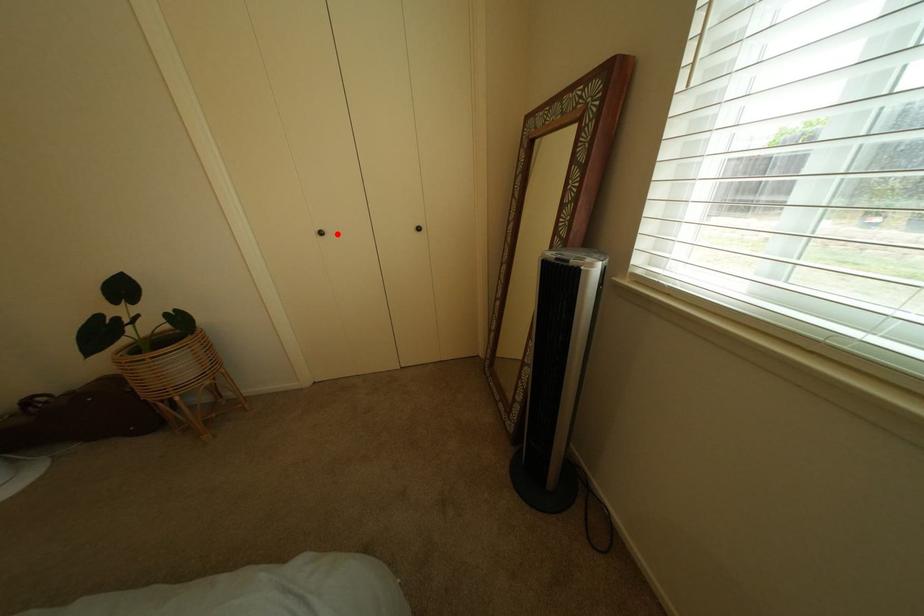
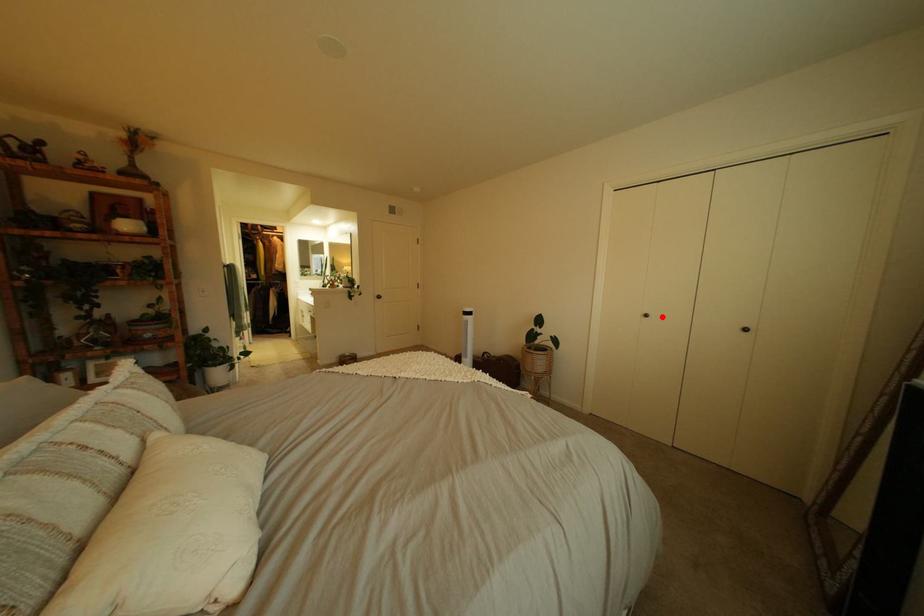
I am providing you with two images of the same scene from different viewpoints. A red point is marked on the first image and another point is marked on the second image. Is the marked point in image1 the same physical position as the marked point in image2?

Yes